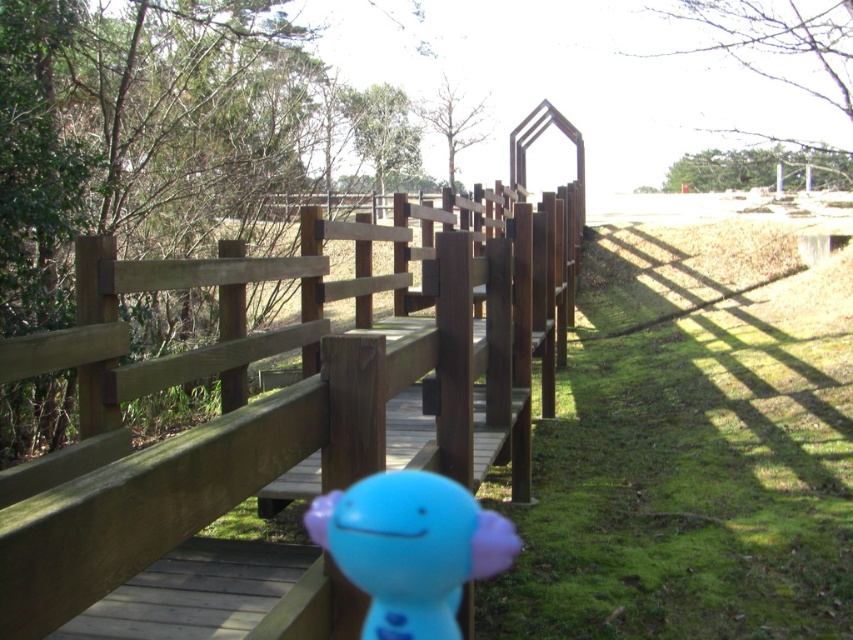
Question: Does wooden bridge at center appear on the right side of blue rubber toy at center?

Choices:
 (A) yes
 (B) no

Answer: (A)

Question: Which point appears farthest from the camera in this image?

Choices:
 (A) (198, 509)
 (B) (450, 552)

Answer: (B)

Question: Is wooden bridge at center positioned at the back of blue rubber toy at center?

Choices:
 (A) no
 (B) yes

Answer: (A)

Question: Is wooden bridge at center above blue rubber toy at center?

Choices:
 (A) no
 (B) yes

Answer: (B)